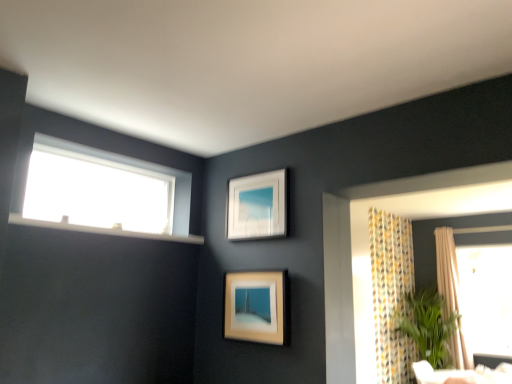
Question: From a real-world perspective, is transparent glass window at upper left on top of white matte picture frame at upper center, which appears as the second picture frame when ordered from the bottom?

Choices:
 (A) yes
 (B) no

Answer: (A)

Question: From the image's perspective, would you say transparent glass window at upper left is positioned over white matte picture frame at upper center, which appears as the second picture frame when ordered from the bottom?

Choices:
 (A) no
 (B) yes

Answer: (B)

Question: Is transparent glass window at upper left positioned far away from white matte picture frame at upper center, the 1th picture frame when ordered from top to bottom?

Choices:
 (A) yes
 (B) no

Answer: (B)

Question: Is transparent glass window at upper left at the left side of white matte picture frame at upper center, the 1th picture frame when ordered from top to bottom?

Choices:
 (A) no
 (B) yes

Answer: (B)

Question: Does transparent glass window at upper left have a greater height compared to white matte picture frame at upper center, which appears as the second picture frame when ordered from the bottom?

Choices:
 (A) yes
 (B) no

Answer: (B)

Question: Does transparent glass window at upper left contain white matte picture frame at upper center, the 1th picture frame when ordered from top to bottom?

Choices:
 (A) yes
 (B) no

Answer: (B)

Question: Is white matte picture frame at upper center, the 1th picture frame when ordered from top to bottom, wider than matte wooden picture frame at center, which is the 1th picture frame from bottom to top?

Choices:
 (A) no
 (B) yes

Answer: (A)

Question: Considering the relative sizes of white matte picture frame at upper center, which appears as the second picture frame when ordered from the bottom, and matte wooden picture frame at center, the 2th picture frame when ordered from top to bottom, in the image provided, is white matte picture frame at upper center, which appears as the second picture frame when ordered from the bottom, smaller than matte wooden picture frame at center, the 2th picture frame when ordered from top to bottom,?

Choices:
 (A) yes
 (B) no

Answer: (A)

Question: Is white matte picture frame at upper center, which appears as the second picture frame when ordered from the bottom, taller than matte wooden picture frame at center, which is the 1th picture frame from bottom to top?

Choices:
 (A) yes
 (B) no

Answer: (B)

Question: Is the position of white matte picture frame at upper center, which appears as the second picture frame when ordered from the bottom, less distant than that of matte wooden picture frame at center, the 2th picture frame when ordered from top to bottom?

Choices:
 (A) yes
 (B) no

Answer: (B)

Question: Is white matte picture frame at upper center, which appears as the second picture frame when ordered from the bottom, next to matte wooden picture frame at center, which is the 1th picture frame from bottom to top?

Choices:
 (A) no
 (B) yes

Answer: (A)

Question: Is white matte picture frame at upper center, which appears as the second picture frame when ordered from the bottom, completely or partially outside of matte wooden picture frame at center, the 2th picture frame when ordered from top to bottom?

Choices:
 (A) yes
 (B) no

Answer: (A)

Question: Can you confirm if matte wooden picture frame at center, the 2th picture frame when ordered from top to bottom, is shorter than white plastic window sill at upper left?

Choices:
 (A) no
 (B) yes

Answer: (A)